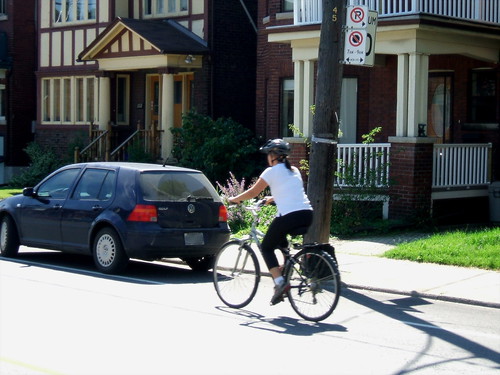
Where is `doors`? The height and width of the screenshot is (375, 500). doors is located at coordinates (436, 108), (176, 110).